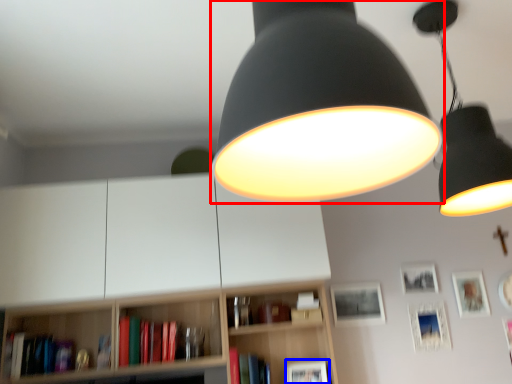
Question: Among these objects, which one is nearest to the camera, lamp (highlighted by a red box) or picture frame (highlighted by a blue box)?

Choices:
 (A) lamp
 (B) picture frame

Answer: (A)